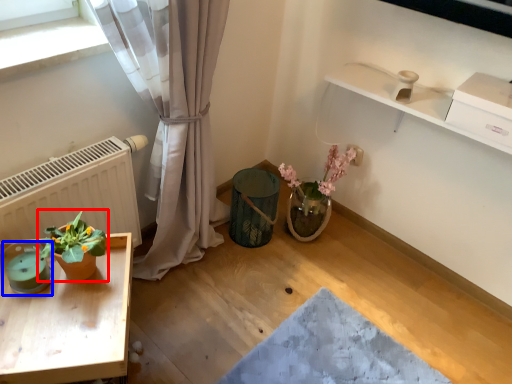
Question: Among these objects, which one is nearest to the camera, houseplant (highlighted by a red box) or teal (highlighted by a blue box)?

Choices:
 (A) houseplant
 (B) teal

Answer: (A)